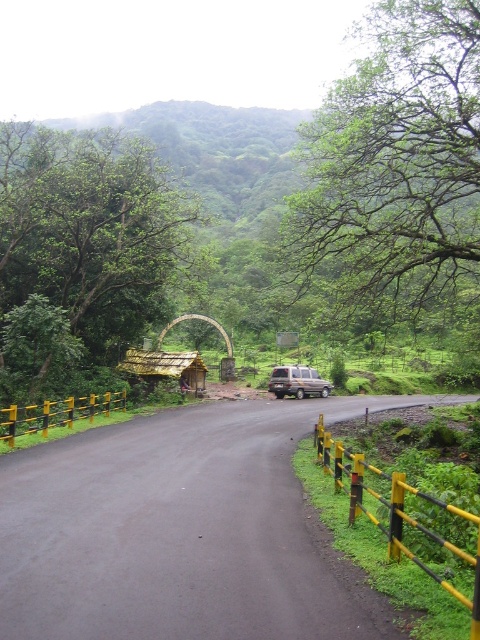
You are a landscape architect designing a new pathway between the green leafy tree at upper center and the green leafy tree at center. Based on their widths, which tree should you consider for placing a wider walkway next to?

The green leafy tree at upper center might be wider than the green leafy tree at center, so the wider walkway should be placed next to the green leafy tree at upper center to accommodate its greater width.

You are a driver approaching the arched gateway in the image. You notice a green leafy tree at upper center and a metallic silver van at center. Which object would block your view of the road ahead more significantly?

The green leafy tree at upper center would block your view more significantly because it is larger in size than the metallic silver van at center.

You are a delivery driver approaching the arched gateway. Your metallic silver van at center is 2.5 meters tall. There is a green leafy tree at center blocking the path. Can your van pass under the tree without hitting it?

The green leafy tree at center is taller than the metallic silver van at center, so the van can pass under the tree as long as the tree branches do not obstruct the path. However, the height of the tree itself does not pose a problem since the van is shorter than the tree.